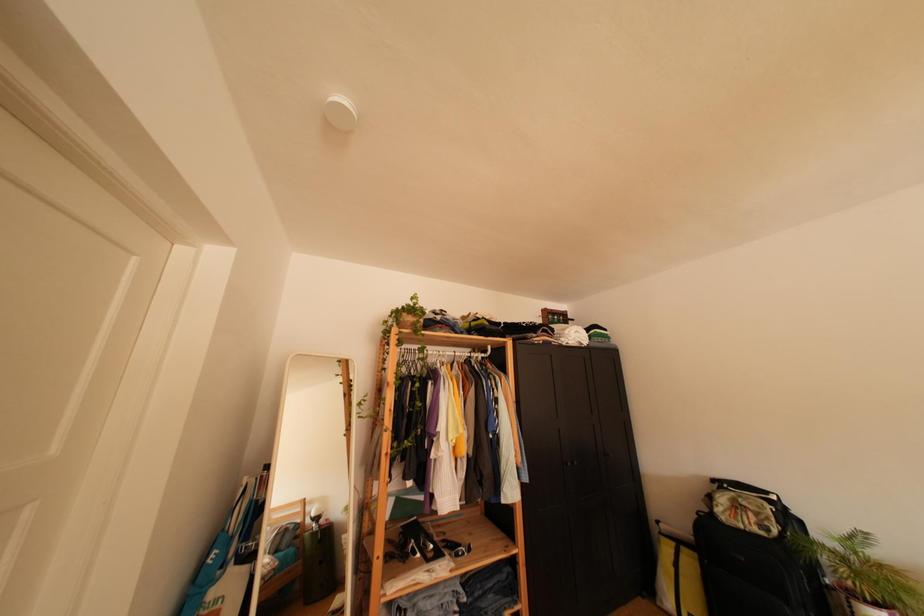
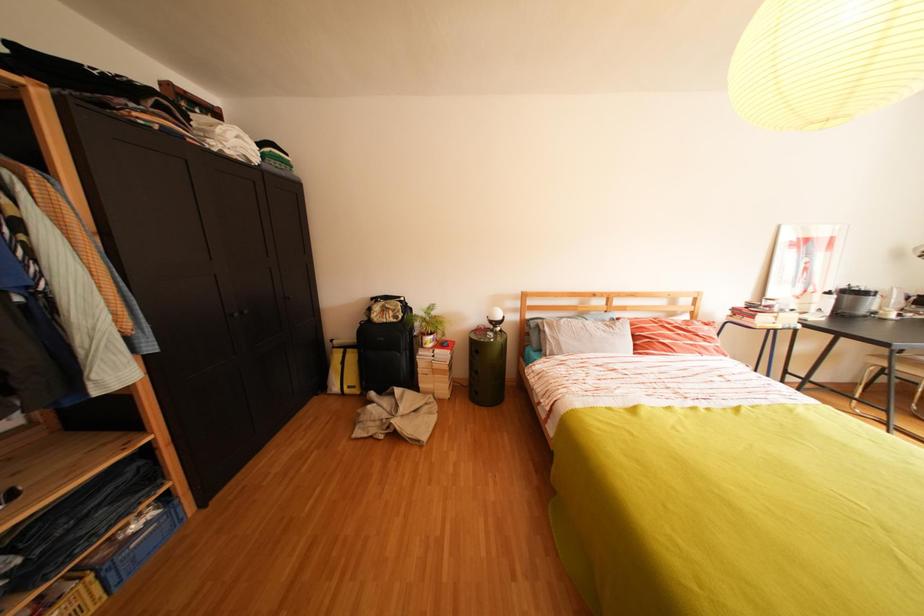
The images are taken continuously from a first-person perspective. In which direction is your viewpoint rotating?

The camera's rotation is toward right-down.